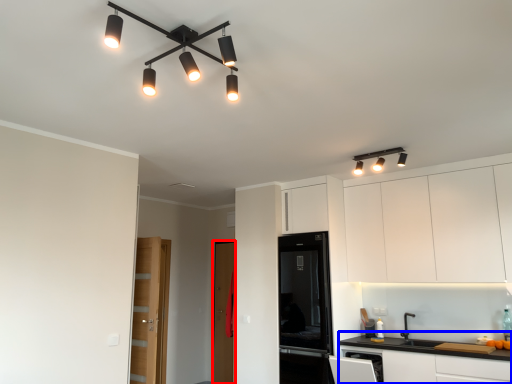
Question: Which point is closer to the camera, glass door (highlighted by a red box) or cabinetry (highlighted by a blue box)?

Choices:
 (A) glass door
 (B) cabinetry

Answer: (B)